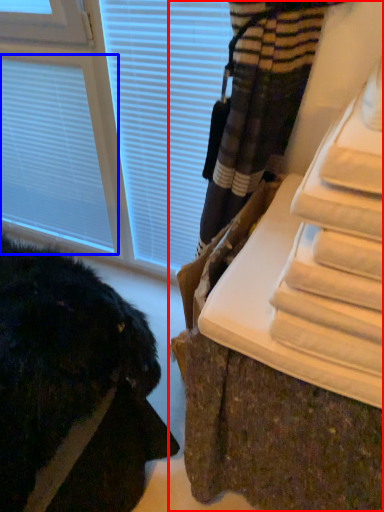
Question: Which object is closer to the camera taking this photo, furniture (highlighted by a red box) or blind (highlighted by a blue box)?

Choices:
 (A) furniture
 (B) blind

Answer: (A)